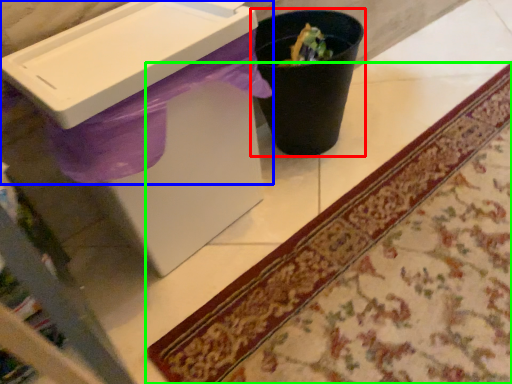
Question: Considering the real-world distances, which object is farthest from waste container (highlighted by a red box)? sink (highlighted by a blue box) or mat (highlighted by a green box)?

Choices:
 (A) sink
 (B) mat

Answer: (B)